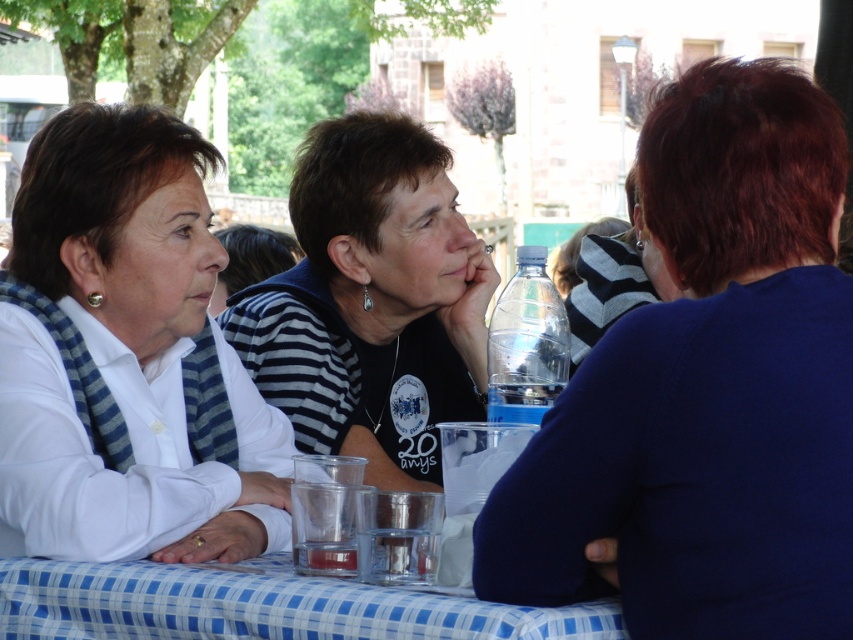
Question: Does white matte shirt at left lie in front of matte black shirt at center?

Choices:
 (A) yes
 (B) no

Answer: (A)

Question: Which point is closer to the camera?

Choices:
 (A) (486, 627)
 (B) (323, 449)
 (C) (165, 486)
 (D) (645, 195)

Answer: (A)

Question: Is blue matte shirt at right positioned before matte black shirt at center?

Choices:
 (A) no
 (B) yes

Answer: (B)

Question: Does blue matte shirt at right appear on the right side of matte black shirt at center?

Choices:
 (A) yes
 (B) no

Answer: (A)

Question: Which object is farther from the camera taking this photo?

Choices:
 (A) blue checkered tablecloth at lower center
 (B) blue matte shirt at right

Answer: (A)

Question: Which point is closer to the camera taking this photo?

Choices:
 (A) (44, 561)
 (B) (422, 344)
 (C) (645, 432)
 (D) (28, 435)

Answer: (C)